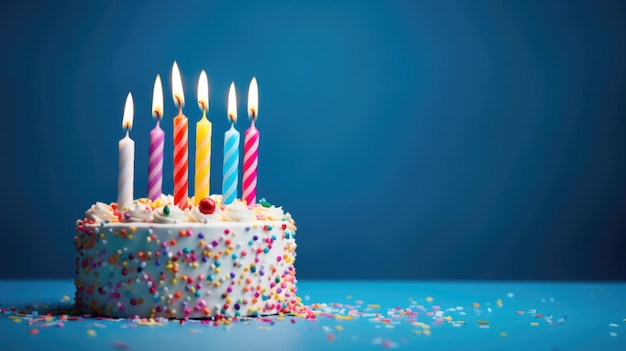
Find the location of a particular element. candle is located at coordinates (118, 161), (153, 144), (176, 140), (198, 141), (226, 148), (244, 155).